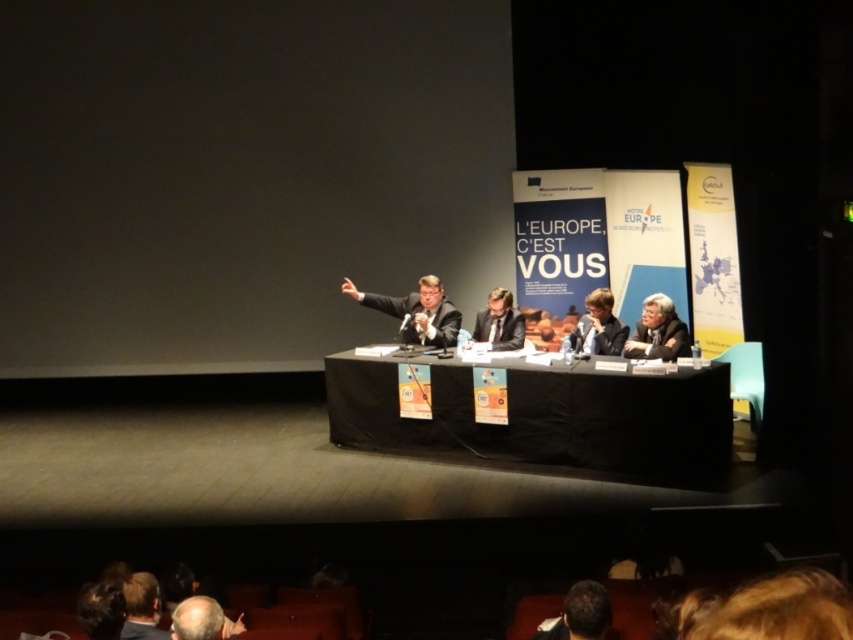
In the scene shown: Is matte black suit at right further to the viewer compared to smooth black suit at center?

No, it is not.

Can you confirm if matte black suit at right is smaller than smooth black suit at center?

No, matte black suit at right is not smaller than smooth black suit at center.

Does point (663, 333) come behind point (576, 323)?

No, (663, 333) is in front of (576, 323).

What are the coordinates of `matte black suit at right` in the screenshot? It's located at (659, 332).

Is black fabric table at center bigger than matte black suit at right?

Correct, black fabric table at center is larger in size than matte black suit at right.

Between black fabric table at center and matte black suit at right, which one appears on the left side from the viewer's perspective?

black fabric table at center

This screenshot has width=853, height=640. What do you see at coordinates (544, 419) in the screenshot? I see `black fabric table at center` at bounding box center [544, 419].

At what (x,y) coordinates should I click in order to perform the action: click on black fabric table at center. Please return your answer as a coordinate pair (x, y). The image size is (853, 640). Looking at the image, I should click on (544, 419).

Does matte black suit at right appear over dark suit at center?

Correct, matte black suit at right is located above dark suit at center.

Can you confirm if matte black suit at right is positioned to the right of dark suit at center?

Indeed, matte black suit at right is positioned on the right side of dark suit at center.

This screenshot has height=640, width=853. I want to click on matte black suit at right, so click(x=659, y=332).